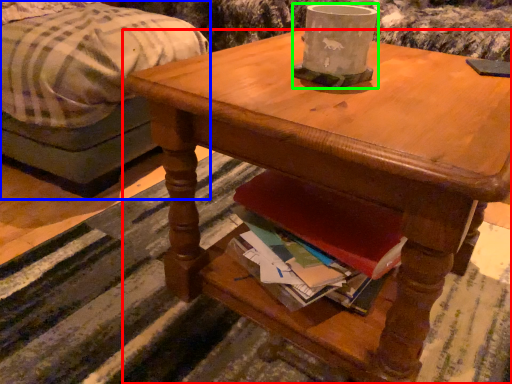
Question: Which object is positioned closest to desk (highlighted by a red box)? Select from studio couch (highlighted by a blue box) and coffee cup (highlighted by a green box).

Choices:
 (A) studio couch
 (B) coffee cup

Answer: (B)